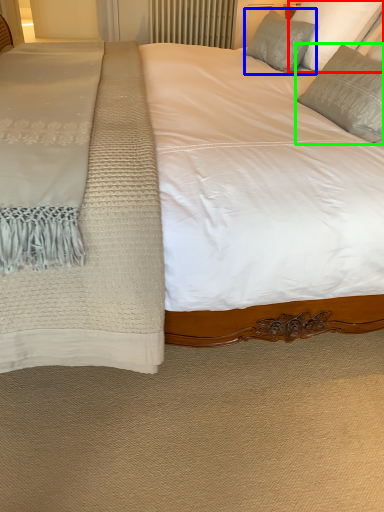
Question: Which is farther away from pillow (highlighted by a red box)? pillow (highlighted by a blue box) or pillow (highlighted by a green box)?

Choices:
 (A) pillow
 (B) pillow

Answer: (B)